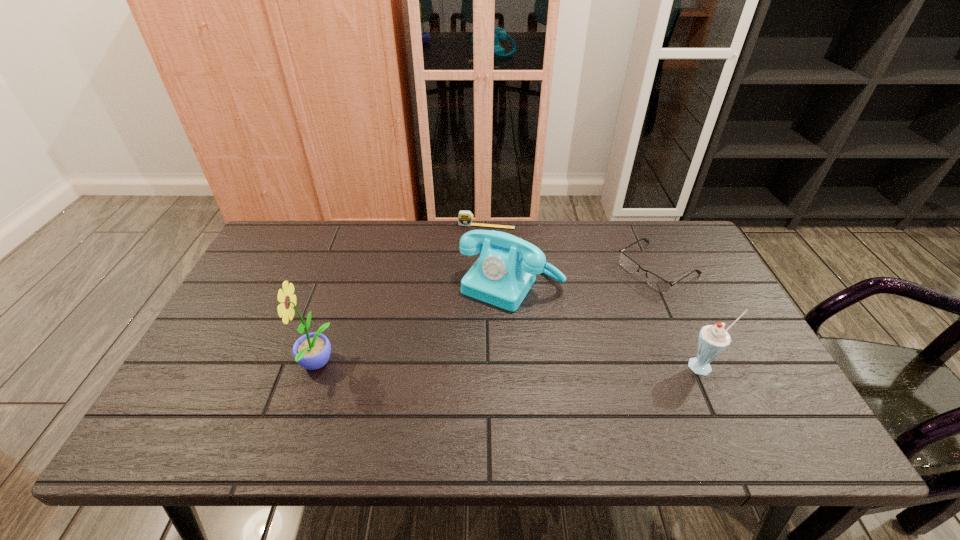
You are a GUI agent. You are given a task and a screenshot of the screen. Output one action in this format:
    pyautogui.click(x=<x>, y=<y>)
    Task: Click on the vacant space at the left edge
    The width and height of the screenshot is (960, 540).
    Given the screenshot: What is the action you would take?
    pyautogui.click(x=273, y=286)

In the image, there is a desktop. Identify the location of vacant space at the right edge. (665, 269).

In order to click on vacant space at the near left corner of the desktop in this screenshot , I will do `click(242, 407)`.

Identify the location of vacant region at the far right corner of the desktop. (665, 264).

I want to click on blank space at the near right corner of the desktop, so click(711, 378).

Identify the location of free space between the sunflower and the telephone. (414, 325).

You are a GUI agent. You are given a task and a screenshot of the screen. Output one action in this format:
    pyautogui.click(x=<x>, y=<y>)
    Task: Click on the free space that is in between the telephone and the spectacles
    The width and height of the screenshot is (960, 540).
    Given the screenshot: What is the action you would take?
    [585, 276]

At what (x,y) coordinates should I click in order to perform the action: click on empty space between the tallest object and the telephone. Please return your answer as a coordinate pair (x, y). Looking at the image, I should click on (x=414, y=325).

Find the location of `unoccupied area between the telephone and the sunflower`. unoccupied area between the telephone and the sunflower is located at coordinates (414, 325).

In order to click on free point between the leftmost object and the spectacles in this screenshot , I will do `click(487, 316)`.